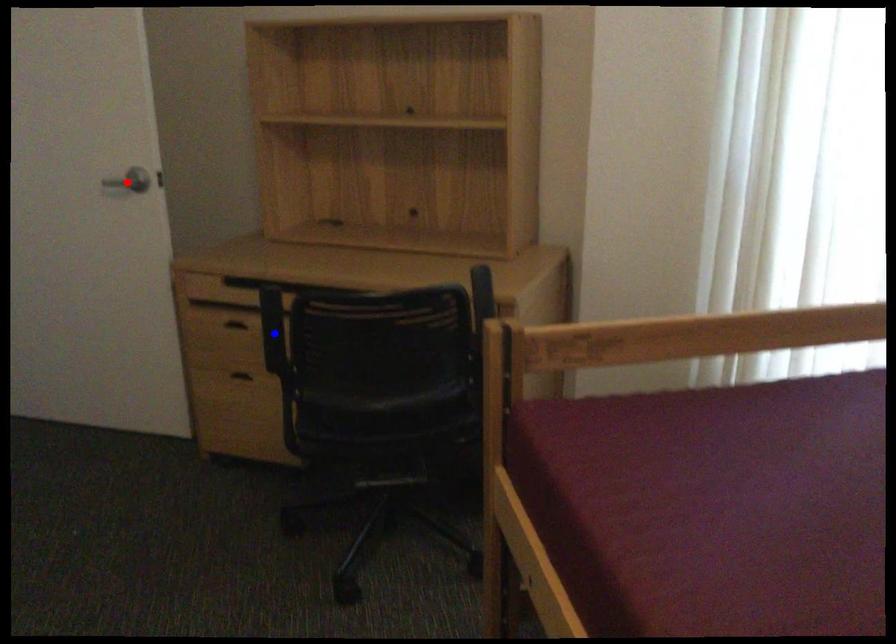
Question: In the image, two points are highlighted. Which point is nearer to the camera? Reply with the corresponding letter.

Choices:
 (A) blue point
 (B) red point

Answer: (A)